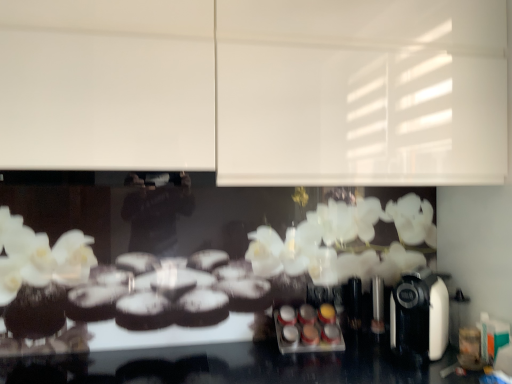
Question: Considering the relative sizes of black plastic coffee machine at right and white matte cabinet at upper center in the image provided, is black plastic coffee machine at right wider than white matte cabinet at upper center?

Choices:
 (A) no
 (B) yes

Answer: (B)

Question: Is black plastic coffee machine at right far from white matte cabinet at upper center?

Choices:
 (A) no
 (B) yes

Answer: (A)

Question: From the image's perspective, is black plastic coffee machine at right located above white matte cabinet at upper center?

Choices:
 (A) yes
 (B) no

Answer: (B)

Question: Would you say black plastic coffee machine at right contains white matte cabinet at upper center?

Choices:
 (A) no
 (B) yes

Answer: (A)

Question: Would you say black plastic coffee machine at right is outside white matte cabinet at upper center?

Choices:
 (A) no
 (B) yes

Answer: (B)

Question: Is black plastic coffee machine at right oriented towards white matte cabinet at upper center?

Choices:
 (A) no
 (B) yes

Answer: (A)

Question: From the image's perspective, would you say white matte cabinet at upper center is shown under black plastic coffee machine at right?

Choices:
 (A) no
 (B) yes

Answer: (A)

Question: Would you say white matte cabinet at upper center contains black plastic coffee machine at right?

Choices:
 (A) yes
 (B) no

Answer: (B)

Question: Considering the relative sizes of white matte cabinet at upper center and black plastic coffee machine at right in the image provided, is white matte cabinet at upper center wider than black plastic coffee machine at right?

Choices:
 (A) yes
 (B) no

Answer: (B)

Question: Can we say white matte cabinet at upper center lies outside black plastic coffee machine at right?

Choices:
 (A) no
 (B) yes

Answer: (B)

Question: Can you confirm if white matte cabinet at upper center is bigger than black plastic coffee machine at right?

Choices:
 (A) yes
 (B) no

Answer: (A)

Question: Considering the relative sizes of white matte cabinet at upper center and black plastic coffee machine at right in the image provided, is white matte cabinet at upper center thinner than black plastic coffee machine at right?

Choices:
 (A) no
 (B) yes

Answer: (B)

Question: Does white matte cabinet at upper center contain metallic silver spice rack at center?

Choices:
 (A) no
 (B) yes

Answer: (A)